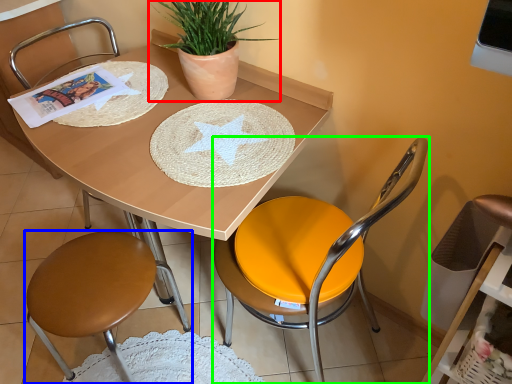
Question: Estimate the real-world distances between objects in this image. Which object is farther from houseplant (highlighted by a red box), chair (highlighted by a blue box) or chair (highlighted by a green box)?

Choices:
 (A) chair
 (B) chair

Answer: (A)